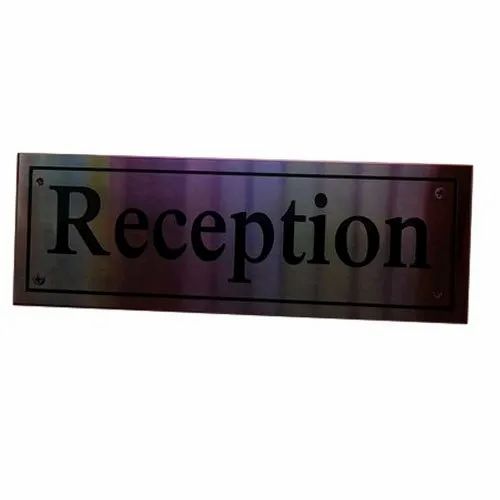
This screenshot has height=500, width=500. Identify the location of screws. (34, 279), (39, 182), (441, 192), (439, 294).